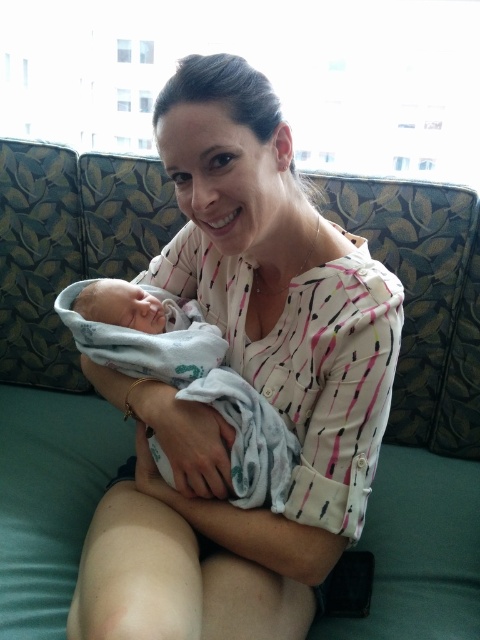
Does point (256, 132) lie behind point (268, 442)?

No, it is in front of (268, 442).

The height and width of the screenshot is (640, 480). In order to click on white cotton shirt at center in this screenshot , I will do `click(249, 380)`.